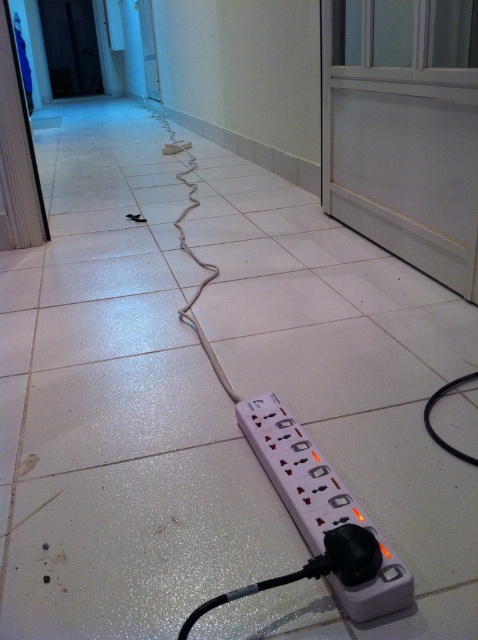
You are standing on the tiled floor and see the white plastic power strip at center and the black rubber wire at lower center. Which object is closer to the right edge of the floor?

The black rubber wire at lower center is closer to the right edge of the floor because the white plastic power strip at center is to the left of it.

You are a delivery person who needs to place a large package on the floor. The package will be placed at point 0.8, 0.6. Will the white plastic power strip at center interfere with the package placement?

The white plastic power strip at center is located at point (x=319, y=502), which is very close to the desired placement point of (x=286, y=512). The package may interfere with the power strip depending on its size. Please adjust the placement slightly to avoid obstruction.

You are an electrician who needs to replace a faulty outlet. You have a tool box that is 18 inches long. You see the white plastic power strip at center and the black rubber wire at lower center. Can your tool box fit between them without bending?

The white plastic power strip at center is 16.21 inches from the black rubber wire at lower center. Since the tool box is 18 inches long, it cannot fit between them without bending.